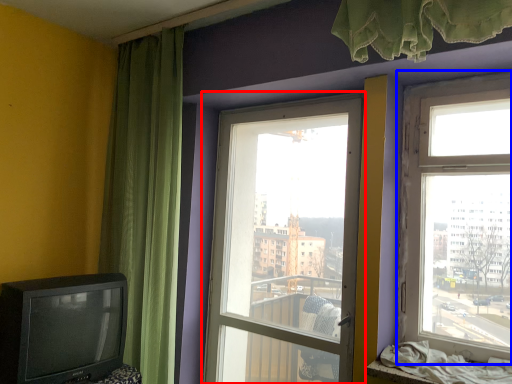
Question: Which of the following is the closest to the observer, window (highlighted by a red box) or window (highlighted by a blue box)?

Choices:
 (A) window
 (B) window

Answer: (B)